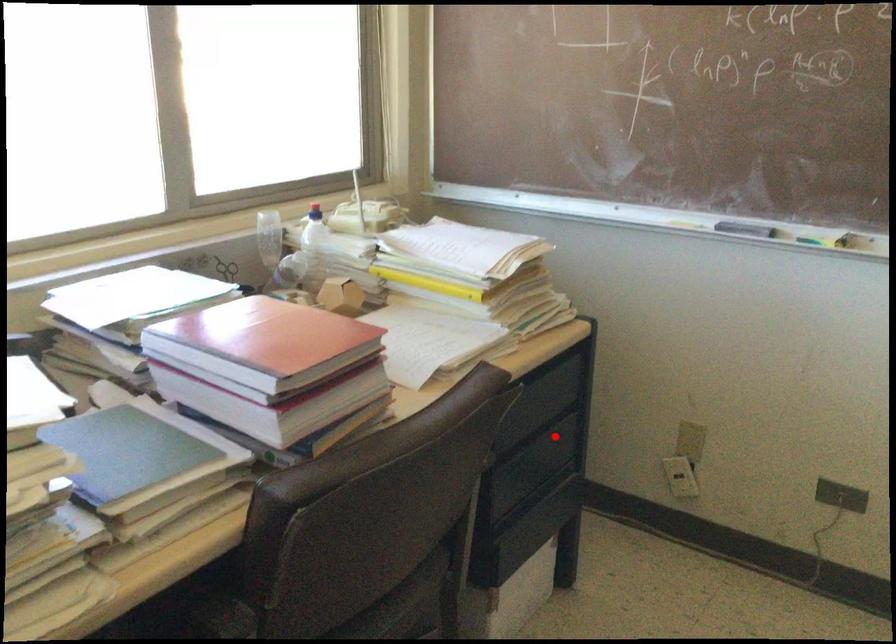
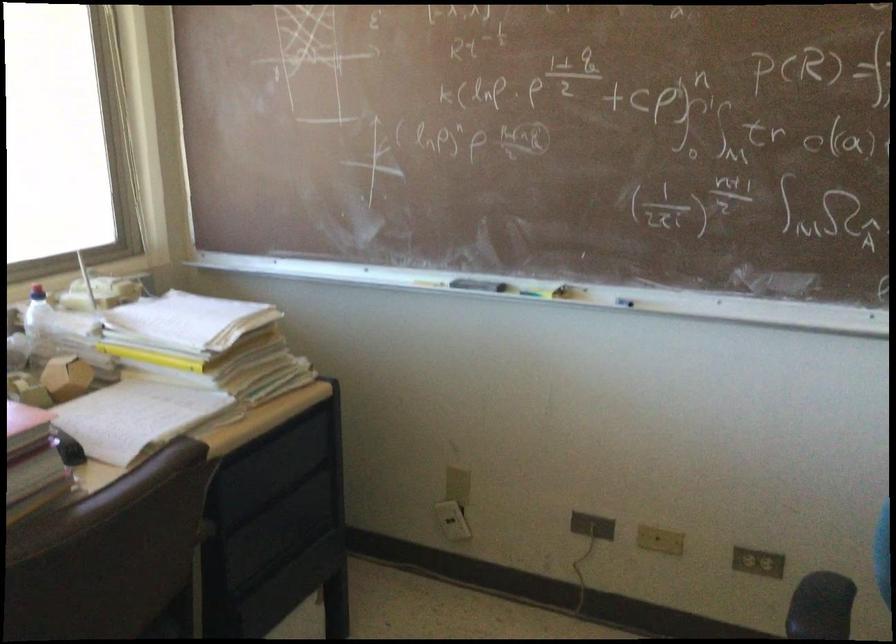
Question: I am providing you with two images of the same scene from different viewpoints. A red point is marked on the first image. Can you still see the location of the red point in image 2?

Choices:
 (A) Yes
 (B) No

Answer: (A)